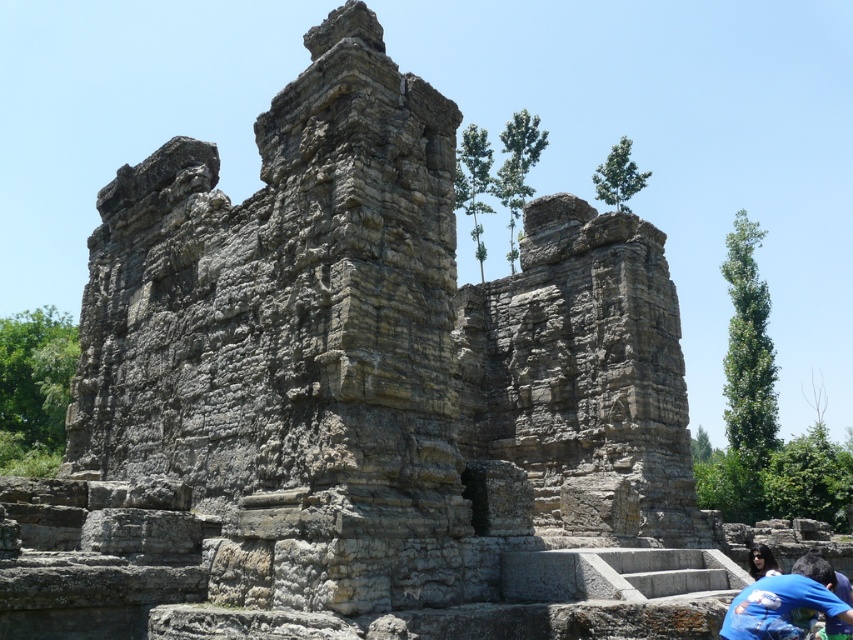
You are a tour guide explaining the historical ruin to visitors. You point to the blue fabric shirt at lower right and the dark blue fabric at lower right. Which one is nearer to the visitors?

The blue fabric shirt at lower right is closer to the viewer than the dark blue fabric at lower right, so the blue fabric shirt at lower right is nearer to the visitors.